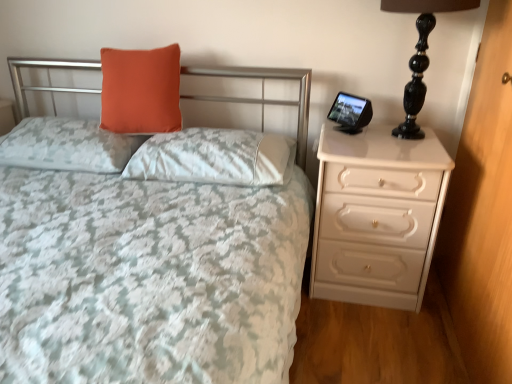
Question: Based on their sizes in the image, would you say matte white bedspread at center is bigger or smaller than white glossy chest of drawers at right?

Choices:
 (A) small
 (B) big

Answer: (B)

Question: From their relative heights in the image, would you say matte white bedspread at center is taller or shorter than white glossy chest of drawers at right?

Choices:
 (A) short
 (B) tall

Answer: (B)

Question: Estimate the real-world distances between objects in this image. Which object is farther from the white glossy dresser at right?

Choices:
 (A) orange fabric pillow at upper left, which ranks as the third pillow in right-to-left order
 (B) matte white bedspread at center
 (C) black glossy table lamp at right
 (D) orange matte pillow at upper center, marked as the second pillow in a right-to-left arrangement
 (E) white glossy chest of drawers at right

Answer: (A)

Question: Considering the real-world distances, which object is farthest from the white glossy dresser at right?

Choices:
 (A) matte white bedspread at center
 (B) orange matte pillow at upper center, marked as the second pillow in a right-to-left arrangement
 (C) orange fabric pillow at upper left, which ranks as the third pillow in right-to-left order
 (D) white satin pillow at center, the 1th pillow in the right-to-left sequence
 (E) black glossy table lamp at right

Answer: (C)